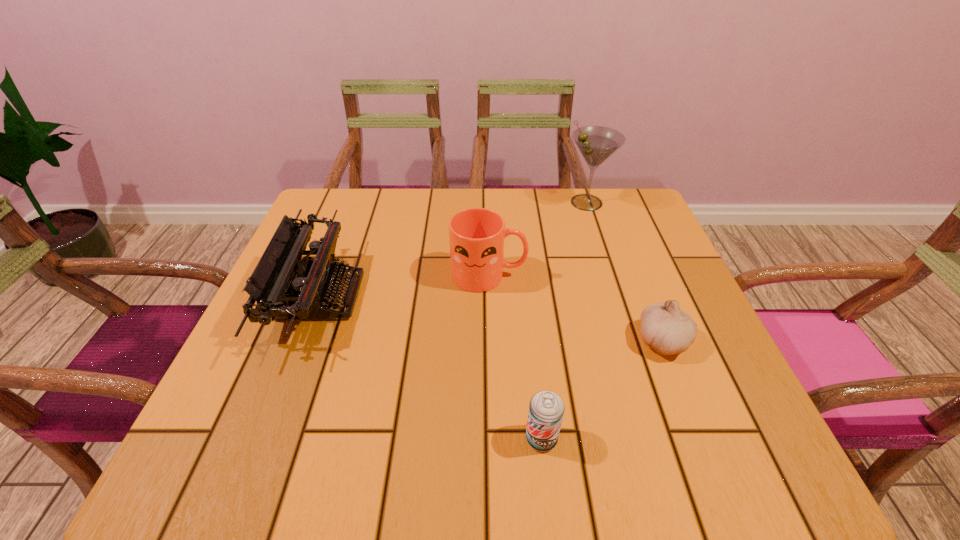
Where is `free space in the image that satisfies the following two spatial constraints: 1. on the handle side of the mug; 2. on the left side of the nearest object`? free space in the image that satisfies the following two spatial constraints: 1. on the handle side of the mug; 2. on the left side of the nearest object is located at coordinates (492, 438).

At what (x,y) coordinates should I click in order to perform the action: click on free space that satisfies the following two spatial constraints: 1. on the typing side of the leftmost object; 2. on the left side of the garlic. Please return your answer as a coordinate pair (x, y). Looking at the image, I should click on (303, 341).

Where is `vacant space that satisfies the following two spatial constraints: 1. on the front side of the tallest object; 2. on the handle side of the mug`? The height and width of the screenshot is (540, 960). vacant space that satisfies the following two spatial constraints: 1. on the front side of the tallest object; 2. on the handle side of the mug is located at coordinates (611, 275).